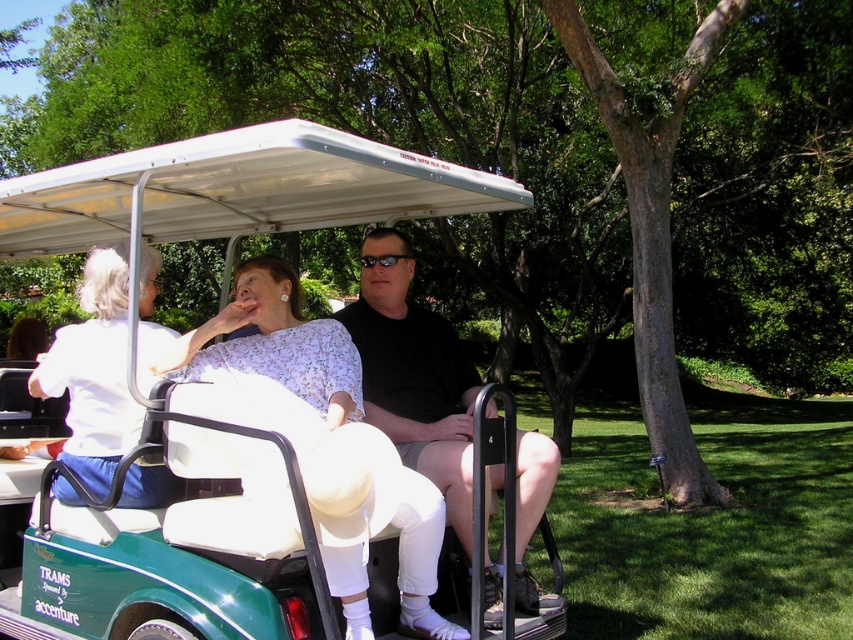
Does green matte golf cart at center have a lesser width compared to floral fabric blouse at center?

No, green matte golf cart at center is not thinner than floral fabric blouse at center.

Which of these two, green matte golf cart at center or floral fabric blouse at center, stands shorter?

green matte golf cart at center is shorter.

Between point (216, 160) and point (282, 276), which one is positioned in front?

Point (216, 160) is in front.

Locate an element on the screen. green matte golf cart at center is located at coordinates (238, 189).

Based on the photo, is green matte golf cart at center behind white matte canopy at upper center?

No, it is not.

Can you confirm if green matte golf cart at center is positioned below white matte canopy at upper center?

Yes.

This screenshot has width=853, height=640. I want to click on green matte golf cart at center, so click(238, 189).

Who is taller, white matte canopy at upper center or black plastic sunglasses at center?

white matte canopy at upper center is taller.

Which is behind, point (200, 177) or point (412, 257)?

Positioned behind is point (412, 257).

Between point (328, 163) and point (372, 257), which one is positioned in front?

Point (328, 163) is more forward.

Where is `white matte canopy at upper center`? The image size is (853, 640). white matte canopy at upper center is located at coordinates (239, 189).